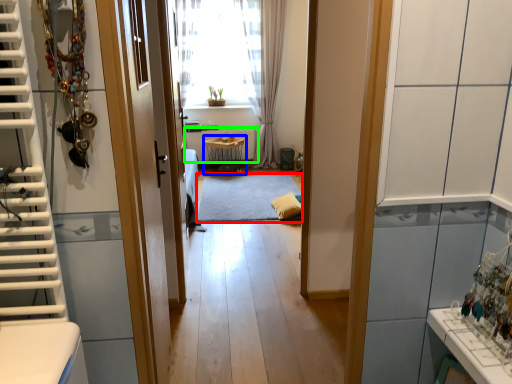
Question: Based on their relative distances, which object is nearer to mat (highlighted by a red box)? Choose from table (highlighted by a blue box) and radiator (highlighted by a green box).

Choices:
 (A) table
 (B) radiator

Answer: (A)